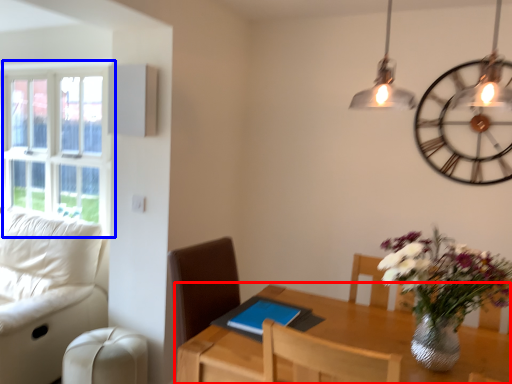
Question: Which of the following is the closest to the observer, table (highlighted by a red box) or window (highlighted by a blue box)?

Choices:
 (A) table
 (B) window

Answer: (A)